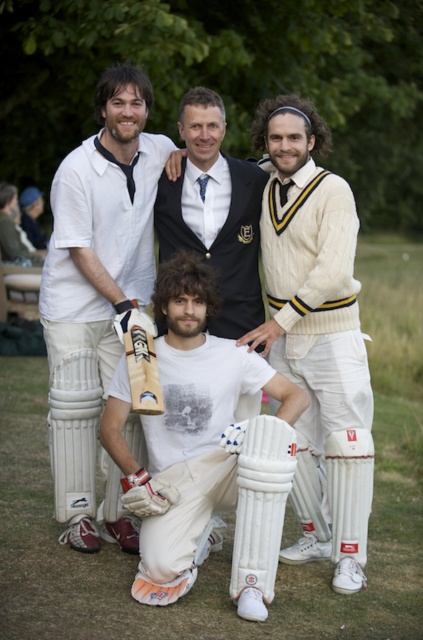
From the picture: Is white leather cricket pads at center below white matte cricket bat at center?

No, white leather cricket pads at center is not below white matte cricket bat at center.

The image size is (423, 640). What are the coordinates of `white leather cricket pads at center` in the screenshot? It's located at (151, 212).

Between point (253, 209) and point (123, 211), which one is positioned in front?

Point (123, 211)

Locate an element on the screen. Image resolution: width=423 pixels, height=640 pixels. white leather cricket pads at center is located at coordinates (151, 212).

Between white leather cricket pads at center and white textured cricket bat at center, which one appears on the right side from the viewer's perspective?

white textured cricket bat at center

Which of these two, white leather cricket pads at center or white textured cricket bat at center, stands shorter?

white textured cricket bat at center is shorter.

Between point (214, 138) and point (217, 184), which one is positioned in front?

Point (214, 138) is in front.

You are a GUI agent. You are given a task and a screenshot of the screen. Output one action in this format:
    pyautogui.click(x=<x>, y=<y>)
    Task: Click on the white leather cricket pads at center
    This screenshot has width=423, height=640.
    Given the screenshot: What is the action you would take?
    pyautogui.click(x=151, y=212)

The image size is (423, 640). Describe the element at coordinates (318, 316) in the screenshot. I see `cable-knit sweater at center` at that location.

Which is behind, point (340, 237) or point (175, 584)?

The point (340, 237) is behind.

Does point (332, 320) come behind point (161, 509)?

Yes.

Locate an element on the screen. The height and width of the screenshot is (640, 423). cable-knit sweater at center is located at coordinates (318, 316).